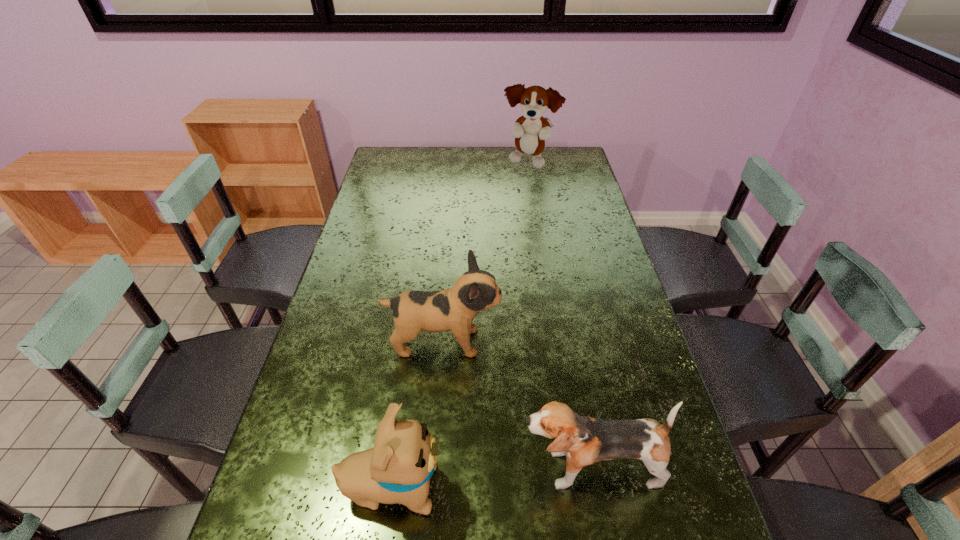
This screenshot has height=540, width=960. I want to click on the tallest puppy, so [x=530, y=131].

At what (x,y) coordinates should I click in order to perform the action: click on the tallest object. Please return your answer as a coordinate pair (x, y). The image size is (960, 540). Looking at the image, I should click on (530, 131).

This screenshot has width=960, height=540. Identify the location of the second farthest object. (454, 309).

Where is `vacant space located 0.070m on the face of the farthest object`? This screenshot has width=960, height=540. vacant space located 0.070m on the face of the farthest object is located at coordinates (532, 185).

The height and width of the screenshot is (540, 960). Find the location of `vacant point located 0.240m at the face of the second farthest puppy`. vacant point located 0.240m at the face of the second farthest puppy is located at coordinates (588, 342).

Locate an element on the screen. object that is at the far edge is located at coordinates (530, 131).

Where is `object that is at the left edge`? This screenshot has width=960, height=540. object that is at the left edge is located at coordinates (398, 468).

Locate an element on the screen. Image resolution: width=960 pixels, height=540 pixels. object positioned at the far right corner is located at coordinates (530, 131).

In order to click on vacant area at the left edge in this screenshot , I will do `click(370, 180)`.

The height and width of the screenshot is (540, 960). Find the location of `vacant space at the right edge of the desktop`. vacant space at the right edge of the desktop is located at coordinates (571, 215).